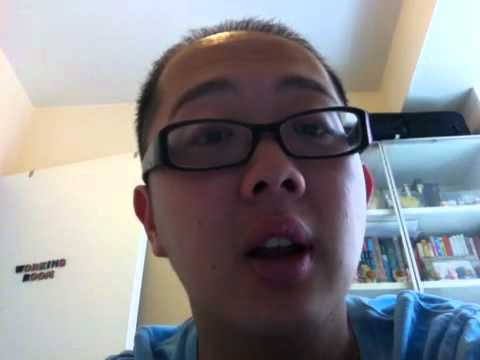
At what (x,y) coordinates should I click in order to perform the action: click on ceiling. Please return your answer as a coordinate pair (x, y). Looking at the image, I should click on (62, 13).